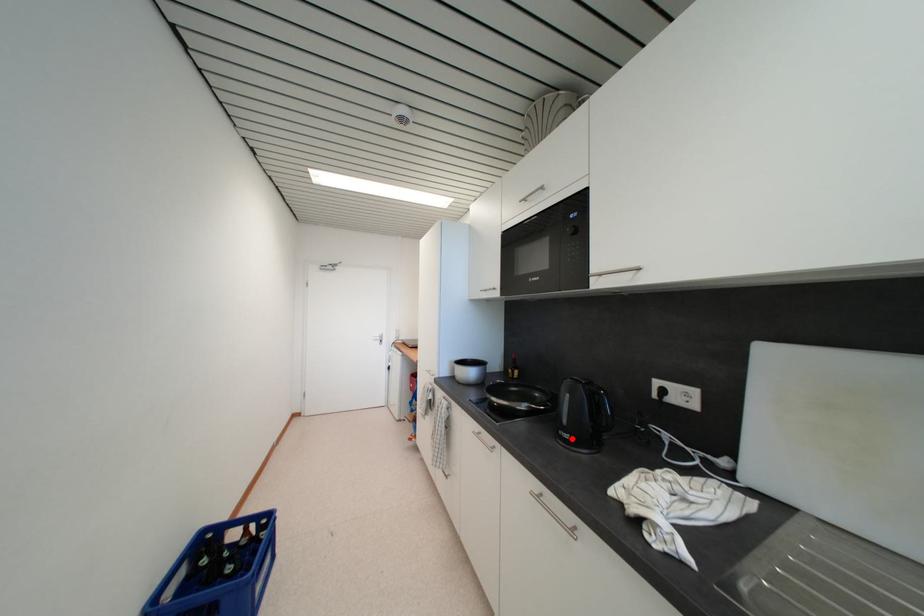
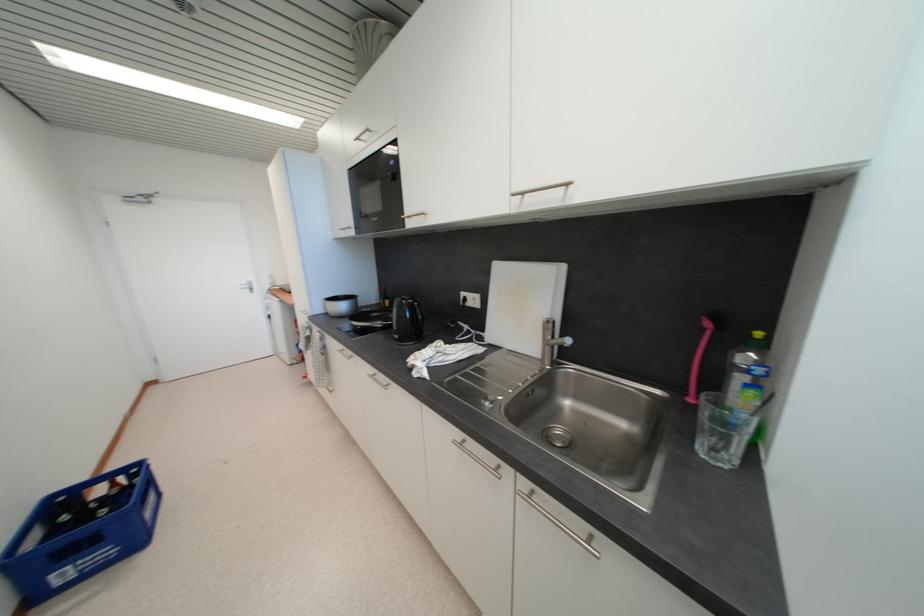
Where in the second image is the point corresponding to the highlighted location from the first image?

(402, 339)